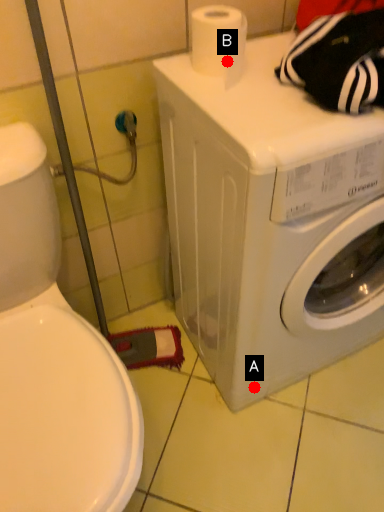
Question: Two points are circled on the image, labeled by A and B beside each circle. Which point appears closest to the camera in this image?

Choices:
 (A) A is closer
 (B) B is closer

Answer: (B)